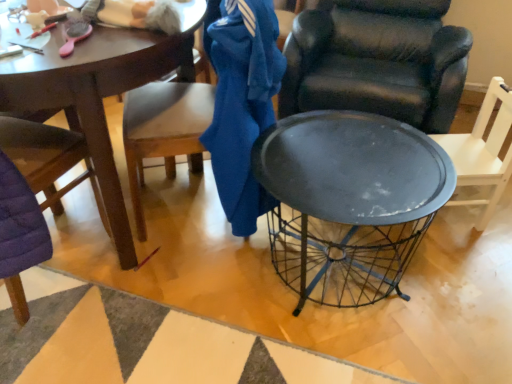
You are a GUI agent. You are given a task and a screenshot of the screen. Output one action in this format:
    pyautogui.click(x=<x>, y=<y>)
    Task: Click on the free space below metallic black table at center (from a real-world perspective)
    This screenshot has width=512, height=384.
    Given the screenshot: What is the action you would take?
    [x=325, y=284]